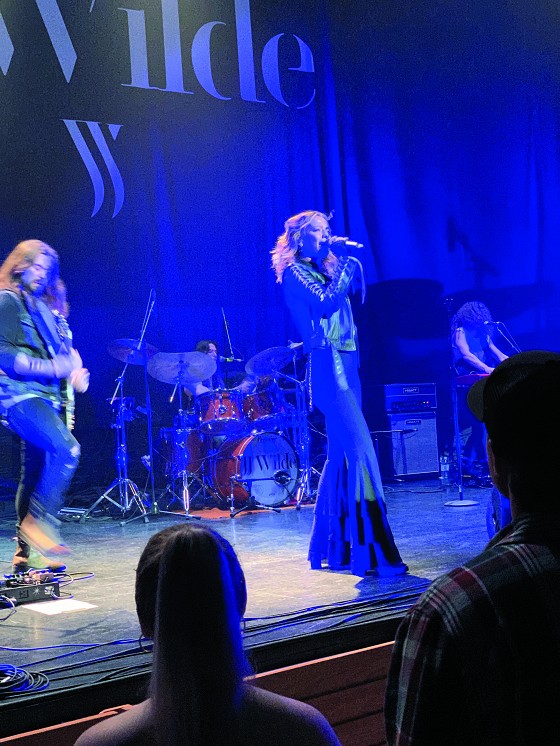
You are a GUI agent. You are given a task and a screenshot of the screen. Output one action in this format:
    pyautogui.click(x=<x>, y=<y>)
    Task: Click on the stage
    The width and height of the screenshot is (560, 746).
    Given the screenshot: What is the action you would take?
    pyautogui.click(x=283, y=564)